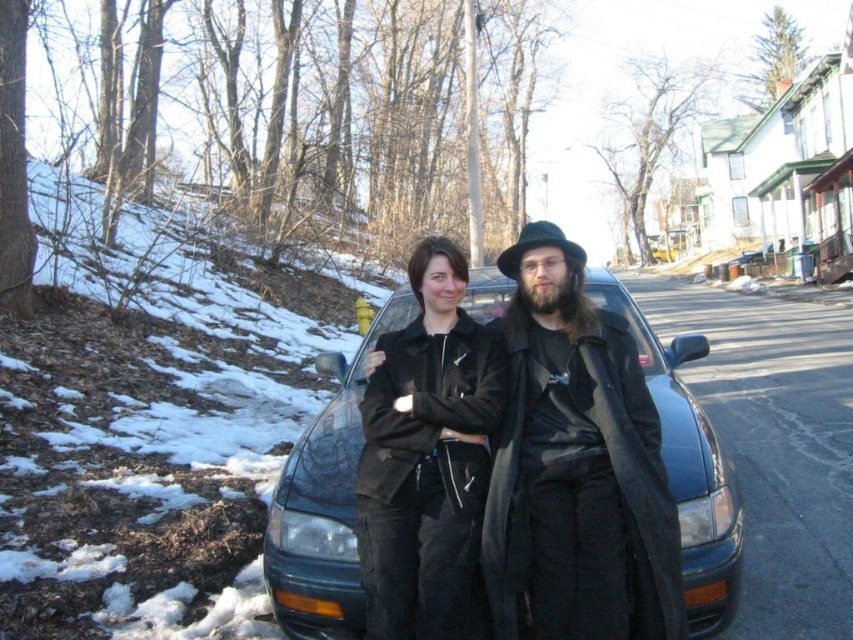
Can you confirm if shiny black car at center is smaller than black matte jacket at center?

Actually, shiny black car at center might be larger than black matte jacket at center.

Does point (351, 417) come closer to viewer compared to point (397, 520)?

No, (351, 417) is behind (397, 520).

Image resolution: width=853 pixels, height=640 pixels. I want to click on shiny black car at center, so click(x=323, y=502).

From the picture: Between black matte coat at center and black matte jacket at center, which one appears on the left side from the viewer's perspective?

black matte jacket at center is more to the left.

Does black matte coat at center have a smaller size compared to black matte jacket at center?

Incorrect, black matte coat at center is not smaller in size than black matte jacket at center.

Is point (618, 573) less distant than point (402, 608)?

Yes.

Locate an element on the screen. The height and width of the screenshot is (640, 853). black matte coat at center is located at coordinates (576, 467).

Does black matte coat at center have a greater width compared to shiny black car at center?

Incorrect, black matte coat at center's width does not surpass shiny black car at center's.

The image size is (853, 640). I want to click on black matte coat at center, so click(x=576, y=467).

This screenshot has height=640, width=853. Identify the location of black matte coat at center. (576, 467).